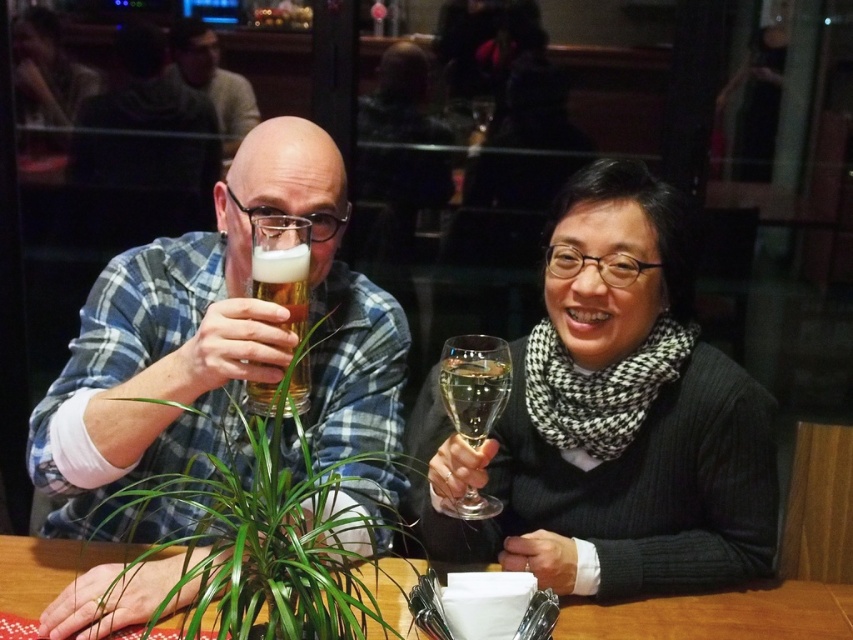
Which is in front, point (175, 579) or point (35, 545)?

Point (175, 579) is more forward.

Does point (132, 433) come in front of point (107, 547)?

That is True.

I want to click on green leafy plant at center, so [189, 376].

Locate an element on the screen. green leafy plant at center is located at coordinates (189, 376).

Is black wool scarf at center to the left of matte black shirt at upper left from the viewer's perspective?

Incorrect, black wool scarf at center is not on the left side of matte black shirt at upper left.

The image size is (853, 640). What do you see at coordinates (612, 419) in the screenshot?
I see `black wool scarf at center` at bounding box center [612, 419].

Which is in front, point (611, 308) or point (210, 61)?

Point (611, 308) is more forward.

I want to click on black wool scarf at center, so click(x=612, y=419).

Is translucent glass beer at left shorter than clear glass wine at center?

In fact, translucent glass beer at left may be taller than clear glass wine at center.

Is point (390, 500) closer to camera compared to point (490, 410)?

No.

Between point (138, 353) and point (488, 420), which one is positioned in front?

Point (488, 420) is more forward.

Image resolution: width=853 pixels, height=640 pixels. What are the coordinates of `translucent glass beer at left` in the screenshot? It's located at (218, 342).